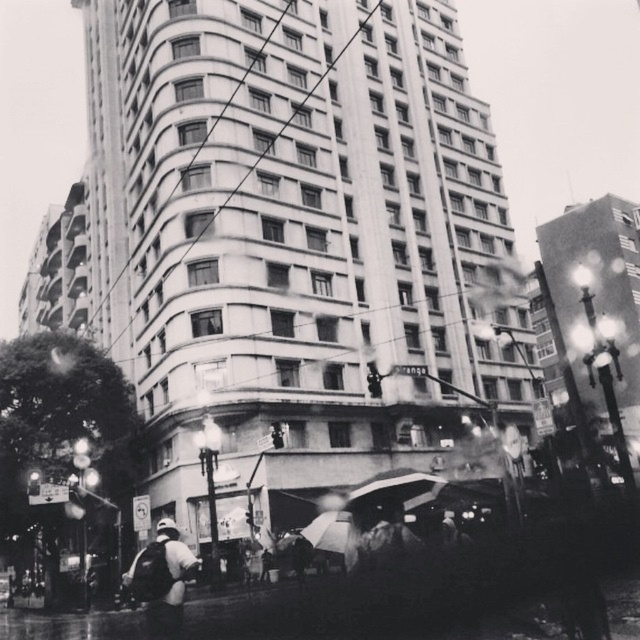
Which is above, white fabric backpack at lower left or transparent plastic umbrella at center?

Positioned higher is transparent plastic umbrella at center.

Is point (157, 632) closer to viewer compared to point (333, 534)?

Yes, point (157, 632) is in front of point (333, 534).

Where is `white fabric backpack at lower left`? This screenshot has height=640, width=640. white fabric backpack at lower left is located at coordinates (161, 580).

Is point (362, 509) positioned in front of point (323, 548)?

Yes, point (362, 509) is in front of point (323, 548).

Based on the photo, does black matte umbrella at center have a larger size compared to transparent plastic umbrella at center?

Indeed, black matte umbrella at center has a larger size compared to transparent plastic umbrella at center.

This screenshot has height=640, width=640. In order to click on black matte umbrella at center in this screenshot , I will do `click(396, 490)`.

Is white fabric backpack at lower left smaller than black matte umbrella at center?

Actually, white fabric backpack at lower left might be larger than black matte umbrella at center.

Between white fabric backpack at lower left and black matte umbrella at center, which one appears on the right side from the viewer's perspective?

black matte umbrella at center is more to the right.

The height and width of the screenshot is (640, 640). Describe the element at coordinates (161, 580) in the screenshot. I see `white fabric backpack at lower left` at that location.

Where is `white fabric backpack at lower left`? Image resolution: width=640 pixels, height=640 pixels. white fabric backpack at lower left is located at coordinates (161, 580).